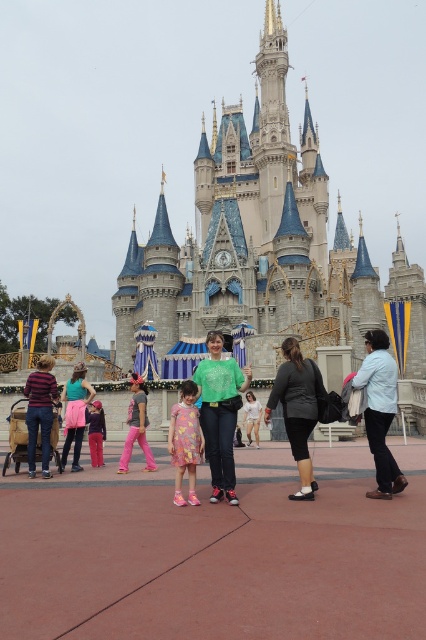
Can you confirm if light blue denim jacket at lower right is taller than matte pink dress at center?

Correct, light blue denim jacket at lower right is much taller as matte pink dress at center.

Describe the element at coordinates (379, 410) in the screenshot. I see `light blue denim jacket at lower right` at that location.

Image resolution: width=426 pixels, height=640 pixels. What are the coordinates of `light blue denim jacket at lower right` in the screenshot? It's located at (379, 410).

Find the location of a particular element. light blue denim jacket at lower right is located at coordinates (379, 410).

Can you confirm if green matte shirt at center is positioned to the right of light blue denim jacket at lower right?

No, green matte shirt at center is not to the right of light blue denim jacket at lower right.

Does green matte shirt at center have a smaller size compared to light blue denim jacket at lower right?

No.

Does point (221, 413) lie in front of point (362, 376)?

No.

The image size is (426, 640). I want to click on green matte shirt at center, so click(x=219, y=413).

Between light blue denim jacket at lower right and matte green shirt at center, which one is positioned higher?

light blue denim jacket at lower right

Does light blue denim jacket at lower right have a greater width compared to matte green shirt at center?

In fact, light blue denim jacket at lower right might be narrower than matte green shirt at center.

What do you see at coordinates (379, 410) in the screenshot? The height and width of the screenshot is (640, 426). I see `light blue denim jacket at lower right` at bounding box center [379, 410].

Identify the location of light blue denim jacket at lower right. This screenshot has height=640, width=426. (379, 410).